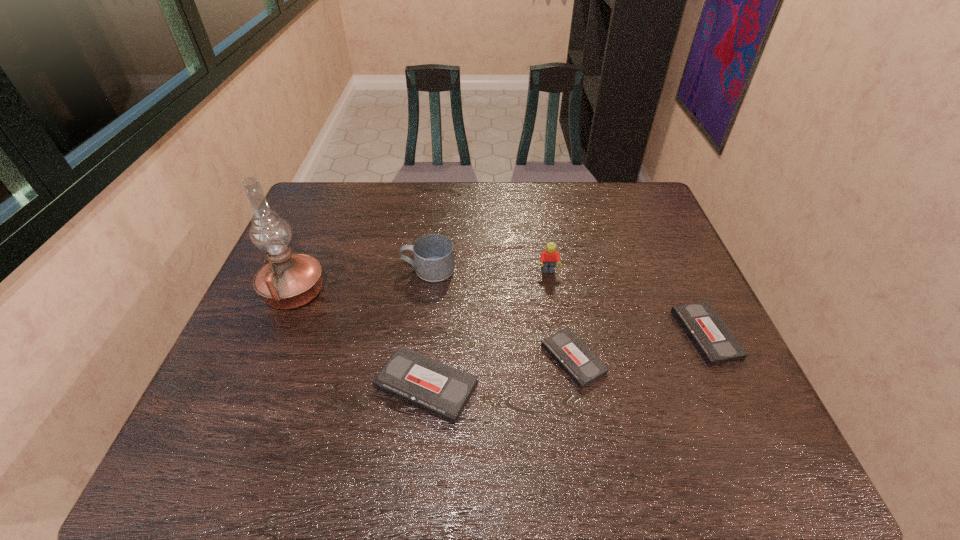
The width and height of the screenshot is (960, 540). What are the coordinates of `blank space located 0.150m on the back of the shortest object` in the screenshot? It's located at (560, 288).

Identify the location of free spot located on the left of the second tallest videotape. This screenshot has height=540, width=960. (x=643, y=334).

Where is `vacant area situated 0.140m on the front of the tallest object`? The height and width of the screenshot is (540, 960). vacant area situated 0.140m on the front of the tallest object is located at coordinates (265, 363).

Image resolution: width=960 pixels, height=540 pixels. Identify the location of vacant space located 0.140m on the face of the Lego. (555, 314).

At what (x,y) coordinates should I click in order to perform the action: click on free space located on the side of the mug with the handle. Please return your answer as a coordinate pair (x, y). The width and height of the screenshot is (960, 540). Looking at the image, I should click on (331, 269).

You are a GUI agent. You are given a task and a screenshot of the screen. Output one action in this format:
    pyautogui.click(x=<x>, y=<y>)
    Task: Click on the free space located on the side of the mug with the handle
    This screenshot has width=960, height=540.
    Given the screenshot: What is the action you would take?
    pyautogui.click(x=342, y=269)

I want to click on free point located 0.180m on the side of the mug with the handle, so click(339, 269).

Locate an element on the screen. The image size is (960, 540). object that is at the left edge is located at coordinates (287, 281).

The height and width of the screenshot is (540, 960). I want to click on object that is at the right edge, so click(x=713, y=340).

In the image, there is a desktop. In order to click on vacant space at the far edge in this screenshot , I will do click(545, 181).